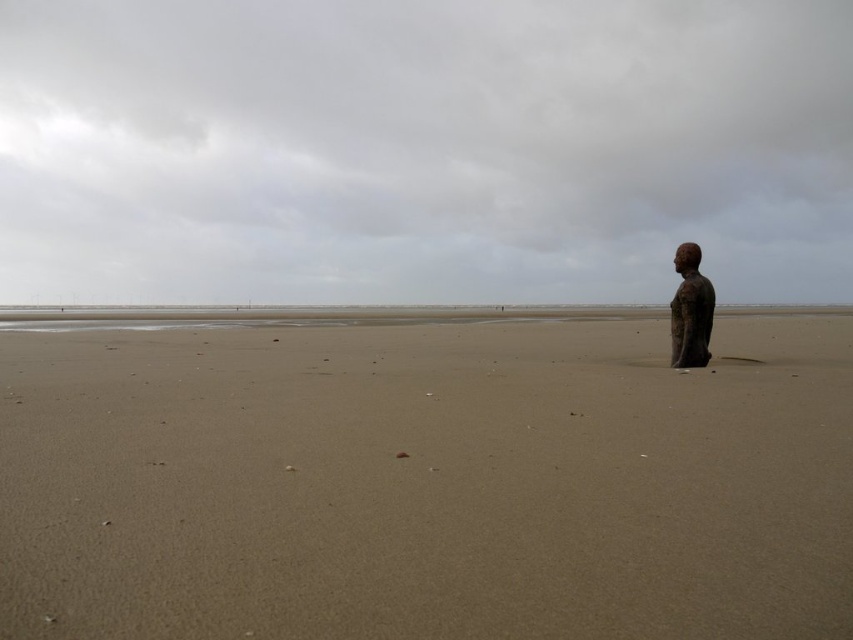
Based on the photo, you are a photographer standing at the edge of the beach looking towards the sculpture. You want to take a photo that includes both the point at coordinates point (x=769, y=70) and point (x=686, y=317). Which point will appear closer to the camera in the photo?

Point (x=769, y=70) will appear closer to the camera in the photo because it is further to the camera than point (x=686, y=317) according to the description.

From the picture: You are standing on the desolate beach scene described. You notice two points marked in the image. Which point is closer to you, point (596, 484) or point (685, 252)?

Point (596, 484) is closer to the viewer than point (685, 252).

You are a photographer trying to capture the bronze statue at right from the smooth sand at lower right. Considering the height of both, will the statue be fully visible in your photo without any obstruction?

The smooth sand at lower right is not as tall as the bronze statue at right, so the statue will be fully visible in your photo without any obstruction.